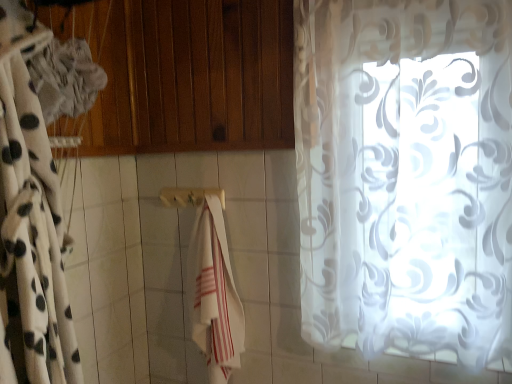
Question: Does transparent floral-patterned curtain at right, which appears as the 2th curtain when viewed from the left, have a lesser height compared to white cotton towel at center?

Choices:
 (A) yes
 (B) no

Answer: (B)

Question: Does transparent floral-patterned curtain at right, arranged as the first curtain when viewed from the right, have a lesser width compared to white cotton towel at center?

Choices:
 (A) no
 (B) yes

Answer: (B)

Question: Can you confirm if transparent floral-patterned curtain at right, arranged as the first curtain when viewed from the right, is wider than white cotton towel at center?

Choices:
 (A) no
 (B) yes

Answer: (A)

Question: Is transparent floral-patterned curtain at right, which appears as the 2th curtain when viewed from the left, in contact with white cotton towel at center?

Choices:
 (A) no
 (B) yes

Answer: (A)

Question: Is the position of transparent floral-patterned curtain at right, arranged as the first curtain when viewed from the right, less distant than that of white cotton towel at center?

Choices:
 (A) yes
 (B) no

Answer: (A)

Question: Looking at their shapes, would you say white cotton towel at center is wider or thinner than wooden towel bar at center?

Choices:
 (A) thin
 (B) wide

Answer: (B)

Question: Considering the positions of point (224, 248) and point (215, 193), is point (224, 248) closer or farther from the camera than point (215, 193)?

Choices:
 (A) farther
 (B) closer

Answer: (A)

Question: Which is correct: white cotton towel at center is inside wooden towel bar at center, or outside of it?

Choices:
 (A) inside
 (B) outside

Answer: (B)

Question: From a real-world perspective, is white cotton towel at center above or below wooden towel bar at center?

Choices:
 (A) above
 (B) below

Answer: (B)

Question: In the image, is white sheer curtain at left, placed as the 1th curtain when sorted from left to right, positioned in front of or behind white cotton towel at center?

Choices:
 (A) behind
 (B) front

Answer: (B)

Question: Considering the positions of white sheer curtain at left, the second curtain viewed from the right, and white cotton towel at center in the image, is white sheer curtain at left, the second curtain viewed from the right, wider or thinner than white cotton towel at center?

Choices:
 (A) thin
 (B) wide

Answer: (B)

Question: In the image, is white sheer curtain at left, the second curtain viewed from the right, on the left side or the right side of white cotton towel at center?

Choices:
 (A) left
 (B) right

Answer: (A)

Question: From a real-world perspective, is white sheer curtain at left, placed as the 1th curtain when sorted from left to right, positioned above or below white cotton towel at center?

Choices:
 (A) below
 (B) above

Answer: (B)

Question: Looking at their shapes, would you say white sheer curtain at left, the second curtain viewed from the right, is wider or thinner than wooden towel bar at center?

Choices:
 (A) thin
 (B) wide

Answer: (B)

Question: Based on their positions, is white sheer curtain at left, the second curtain viewed from the right, located to the left or right of wooden towel bar at center?

Choices:
 (A) left
 (B) right

Answer: (A)